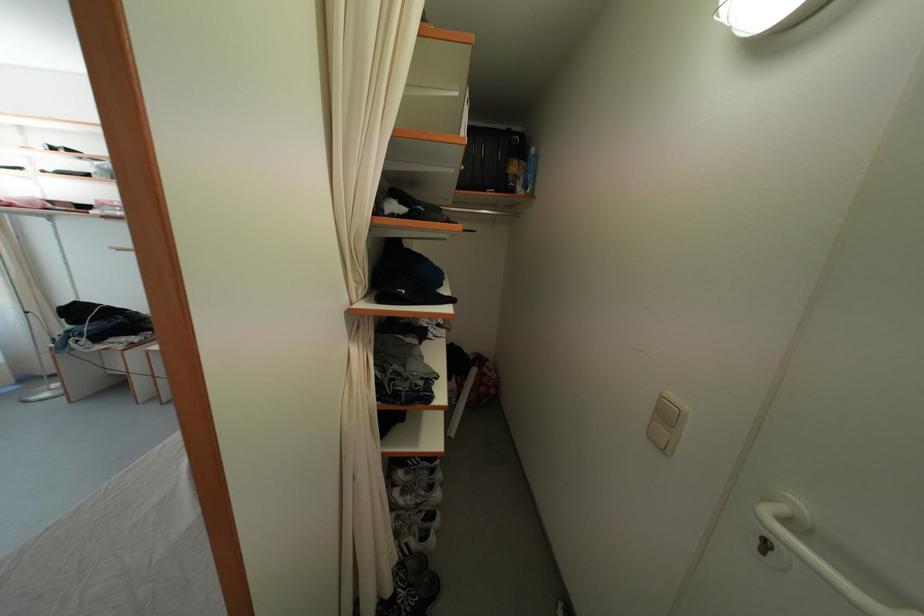
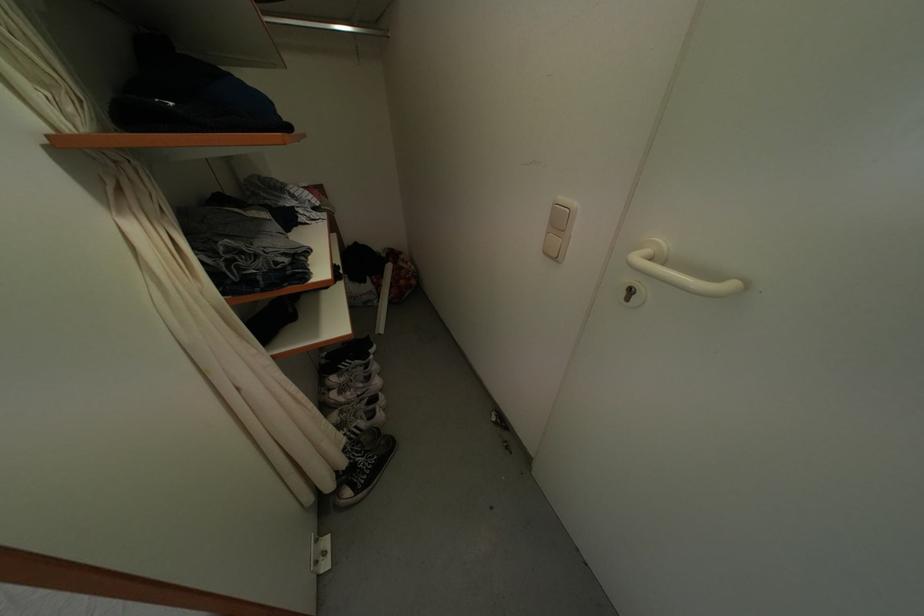
Where in the second image is the point corresponding to [672,421] from the first image?

(565, 228)